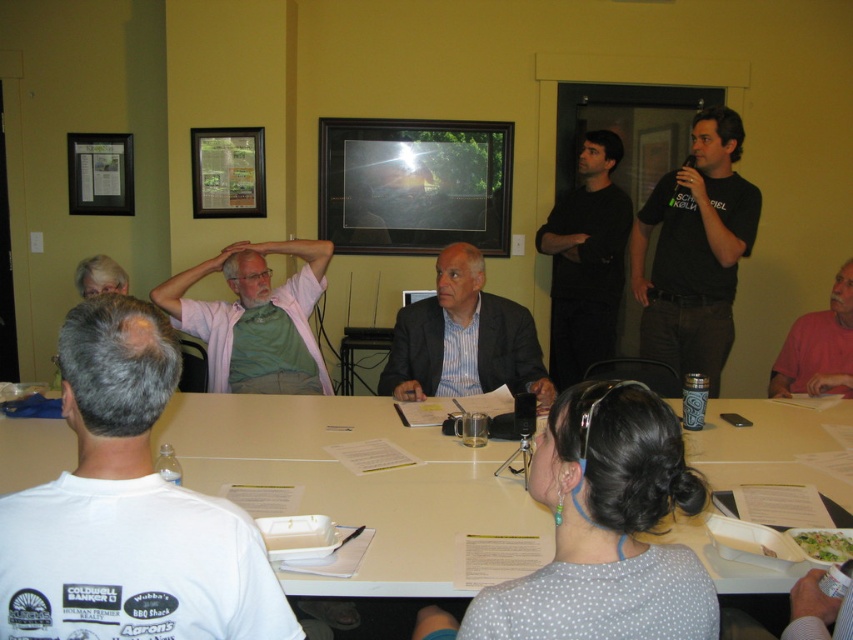
Question: Among these points, which one is farthest from the camera?

Choices:
 (A) pos(712,344)
 (B) pos(125,163)
 (C) pos(91,285)
 (D) pos(209,326)

Answer: (B)

Question: Is green fabric shirt at center closer to the viewer compared to pink shirt at lower right?

Choices:
 (A) yes
 (B) no

Answer: (B)

Question: Does black cotton shirt at upper right lie in front of blue striped shirt at center?

Choices:
 (A) no
 (B) yes

Answer: (A)

Question: Can you confirm if wooden framed poster at upper left is positioned to the right of gray hair at upper left?

Choices:
 (A) yes
 (B) no

Answer: (A)

Question: Which of these objects is positioned farthest from the wooden framed poster at upper left?

Choices:
 (A) black matte shirt at upper center
 (B) white plastic table at center
 (C) green fabric shirt at center

Answer: (B)

Question: Which point appears farthest from the camera in this image?

Choices:
 (A) (270, 340)
 (B) (607, 305)
 (C) (256, 125)

Answer: (B)